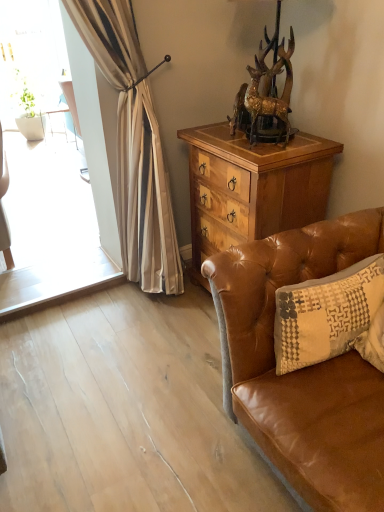
Where is `vacant space behind gold metallic deer at upper center`? The image size is (384, 512). vacant space behind gold metallic deer at upper center is located at coordinates (264, 140).